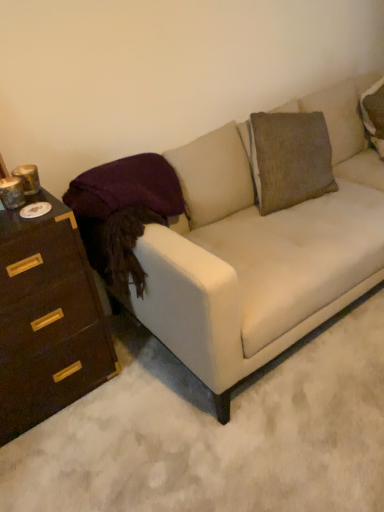
You are a GUI agent. You are given a task and a screenshot of the screen. Output one action in this format:
    pyautogui.click(x=<x>, y=<y>)
    Task: Click on the space that is in front of dark brown wood chest of drawers at left
    This screenshot has width=384, height=512.
    Given the screenshot: What is the action you would take?
    pyautogui.click(x=70, y=459)